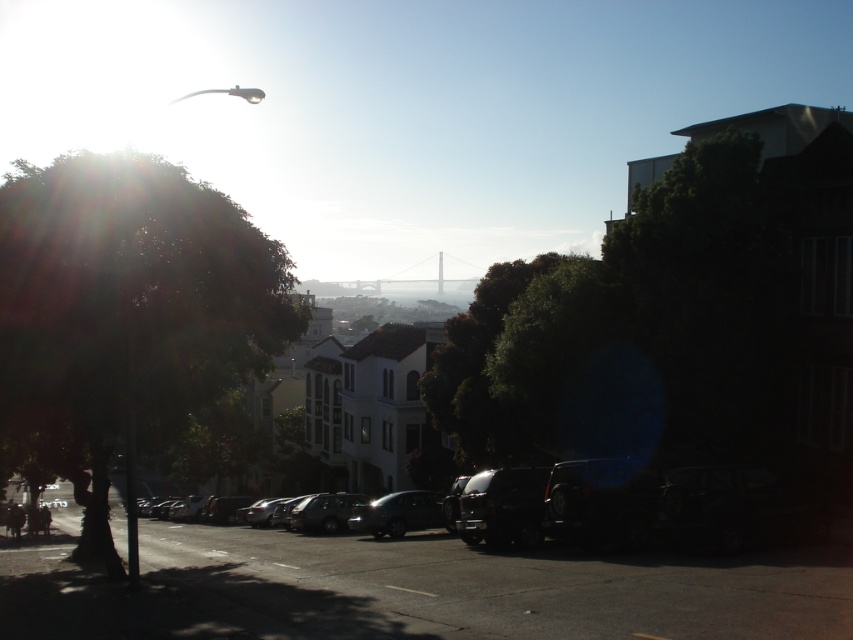
Does green leafy tree at center appear under shiny black car at center?

No.

Does point (498, 429) come in front of point (358, 506)?

That is True.

Image resolution: width=853 pixels, height=640 pixels. Identify the location of green leafy tree at center. (514, 356).

Is green leafy tree at left smaller than green leafy tree at center?

Incorrect, green leafy tree at left is not smaller in size than green leafy tree at center.

Can you confirm if green leafy tree at left is shorter than green leafy tree at center?

Incorrect, green leafy tree at left's height does not fall short of green leafy tree at center's.

Consider the image. Who is more distant from viewer, (125, 204) or (508, 444)?

The point (508, 444) is more distant.

You are a GUI agent. You are given a task and a screenshot of the screen. Output one action in this format:
    pyautogui.click(x=<x>, y=<y>)
    Task: Click on the green leafy tree at left
    This screenshot has width=853, height=640.
    Given the screenshot: What is the action you would take?
    click(x=125, y=316)

Who is higher up, green leafy tree at left or shiny black car at center?

green leafy tree at left is higher up.

Does green leafy tree at left come in front of shiny black car at center?

Yes, green leafy tree at left is closer to the viewer.

Does point (26, 266) lie behind point (437, 515)?

No, it is not.

Identify the location of green leafy tree at left. This screenshot has height=640, width=853. tap(125, 316).